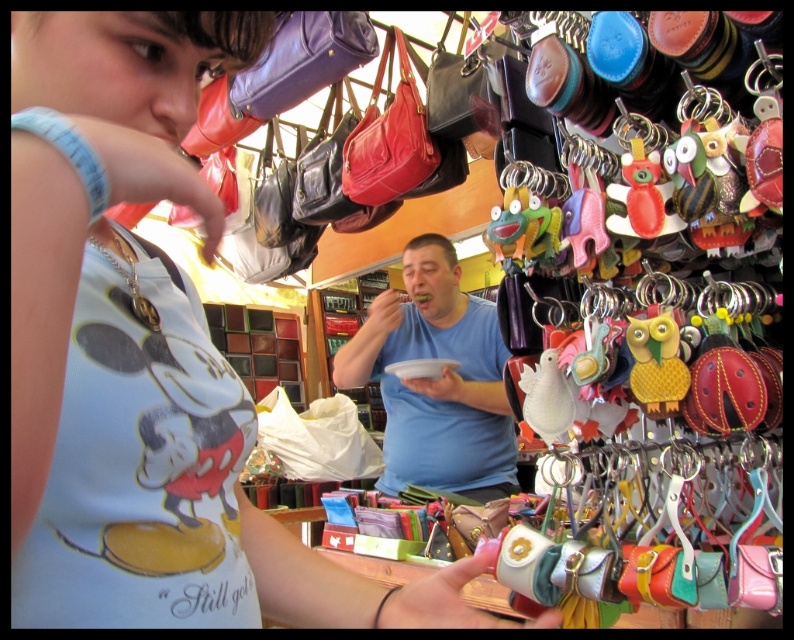
You are a customer at the market stall and want to buy a blue top. The store has two options available, the matte blue tank top at center and the blue matte shirt at center. Which one takes up more space when displayed on the rack?

The blue matte shirt at center takes up more space when displayed on the rack because the matte blue tank top at center occupies less space than blue matte shirt at center.